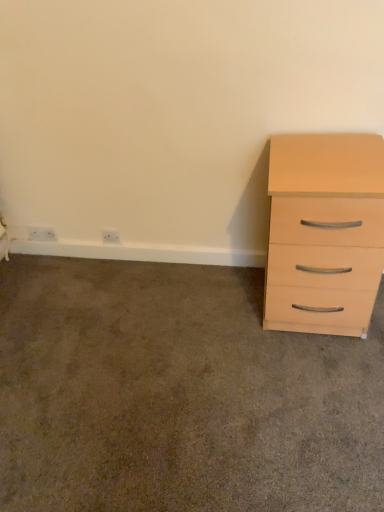
Question: Is white plastic outlet at lower left, which ranks as the first electric outlet in right-to-left order, inside or outside of beige wood drawer at right?

Choices:
 (A) inside
 (B) outside

Answer: (B)

Question: Is white plastic outlet at lower left, the second electric outlet from the left, taller or shorter than beige wood drawer at right?

Choices:
 (A) tall
 (B) short

Answer: (A)

Question: Which object is the closest to the beige wood drawer at right?

Choices:
 (A) white plastic electric outlet at lower left, which ranks as the first electric outlet in left-to-right order
 (B) light wood/finish chest of drawers at right
 (C) white plastic outlet at lower left, the second electric outlet from the left

Answer: (B)

Question: Estimate the real-world distances between objects in this image. Which object is closer to the light wood/finish chest of drawers at right?

Choices:
 (A) white plastic outlet at lower left, which ranks as the first electric outlet in right-to-left order
 (B) white plastic electric outlet at lower left, the 2th electric outlet when ordered from right to left
 (C) beige wood drawer at right

Answer: (C)